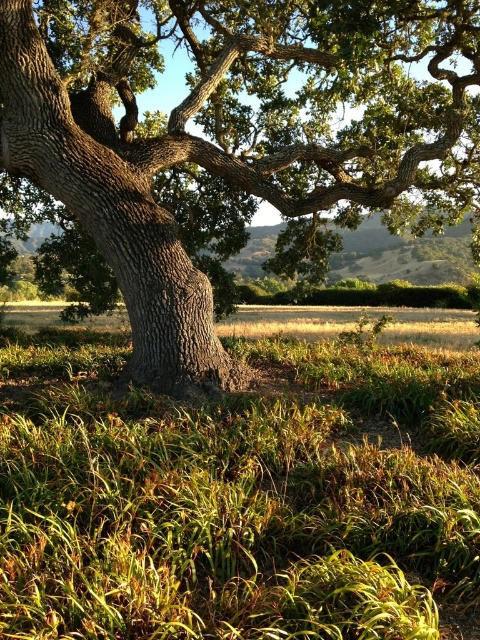
You are standing at the base of the large tree and want to walk to a point that is behind both point (300, 467) and point (179, 252). Which direction should you move relative to the tree?

You should move away from the tree towards the background field because point (179, 252) is behind point (300, 467), and both are in front of the background field.

In the scene shown: You are standing in the field and want to reach the oak tree. Which direction should you walk to get to the smooth bark oak tree at center from the green grass at center?

The green grass at center is in front of the smooth bark oak tree at center, so you are already at the oak tree.